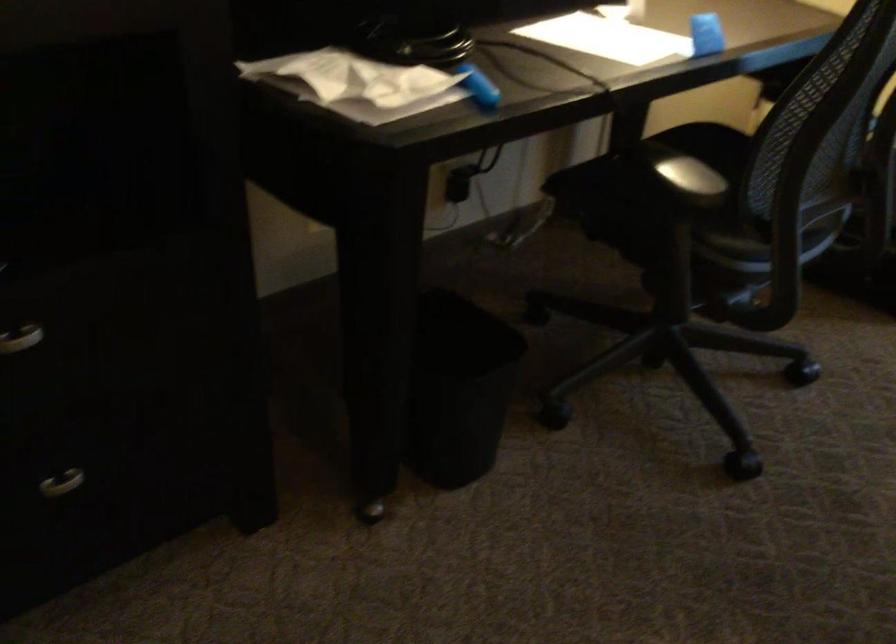
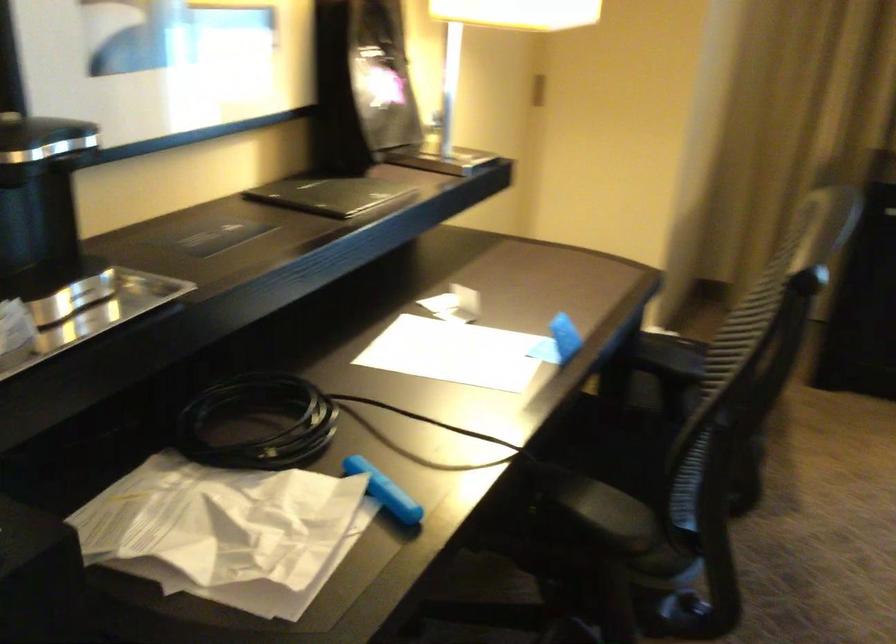
Question: The images are taken continuously from a first-person perspective. In which direction is your viewpoint rotating?

Choices:
 (A) Left
 (B) Right
 (C) Up
 (D) Down

Answer: (B)